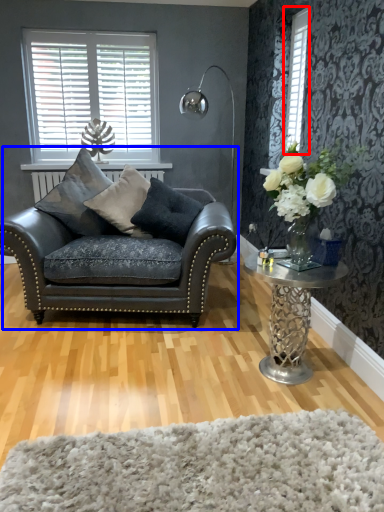
Question: Which of the following is the farthest to the observer, window (highlighted by a red box) or studio couch (highlighted by a blue box)?

Choices:
 (A) window
 (B) studio couch

Answer: (A)